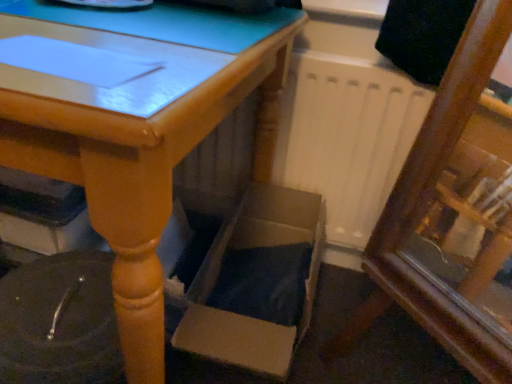
Question: Considering the relative sizes of wooden table at center and cardboard box at lower center in the image provided, is wooden table at center thinner than cardboard box at lower center?

Choices:
 (A) no
 (B) yes

Answer: (A)

Question: Is wooden table at center directly adjacent to cardboard box at lower center?

Choices:
 (A) yes
 (B) no

Answer: (B)

Question: Can you confirm if wooden table at center is taller than cardboard box at lower center?

Choices:
 (A) no
 (B) yes

Answer: (B)

Question: Is wooden table at center looking in the opposite direction of cardboard box at lower center?

Choices:
 (A) yes
 (B) no

Answer: (B)

Question: Is wooden table at center not close to cardboard box at lower center?

Choices:
 (A) no
 (B) yes

Answer: (A)

Question: Does wooden table at center have a greater width compared to cardboard box at lower center?

Choices:
 (A) yes
 (B) no

Answer: (A)

Question: Is cardboard box at lower center with wooden table at center?

Choices:
 (A) yes
 (B) no

Answer: (B)

Question: Is cardboard box at lower center taller than wooden table at center?

Choices:
 (A) yes
 (B) no

Answer: (B)

Question: From a real-world perspective, does cardboard box at lower center stand above wooden table at center?

Choices:
 (A) no
 (B) yes

Answer: (A)

Question: Can you confirm if cardboard box at lower center is smaller than wooden table at center?

Choices:
 (A) yes
 (B) no

Answer: (A)

Question: Is cardboard box at lower center far from wooden table at center?

Choices:
 (A) no
 (B) yes

Answer: (A)

Question: From a real-world perspective, is cardboard box at lower center physically below wooden table at center?

Choices:
 (A) no
 (B) yes

Answer: (B)

Question: Do you think wooden table at center is within cardboard box at lower center, or outside of it?

Choices:
 (A) inside
 (B) outside

Answer: (B)